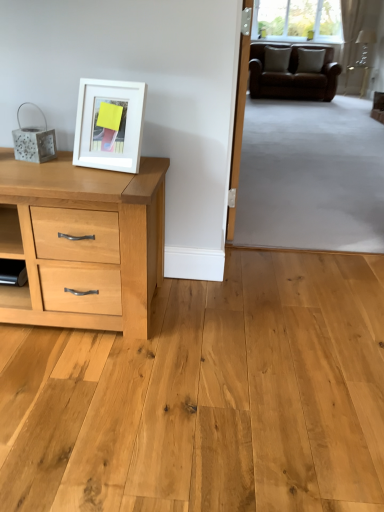
Find the location of a particular element. white matte picture frame at upper left is located at coordinates (109, 125).

Describe the element at coordinates (109, 125) in the screenshot. The width and height of the screenshot is (384, 512). I see `white matte picture frame at upper left` at that location.

The image size is (384, 512). In order to click on white matte picture frame at upper left in this screenshot , I will do `click(109, 125)`.